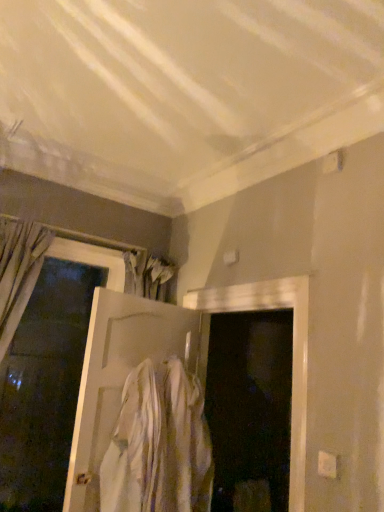
Question: Is white cotton shirt at center positioned before white matte door at center, positioned as the second door in left-to-right order?

Choices:
 (A) no
 (B) yes

Answer: (B)

Question: Considering the relative sizes of white cotton shirt at center and white matte door at center, the first door when ordered from right to left, in the image provided, is white cotton shirt at center thinner than white matte door at center, the first door when ordered from right to left,?

Choices:
 (A) yes
 (B) no

Answer: (B)

Question: Is white cotton shirt at center at the right side of white matte door at center, positioned as the second door in left-to-right order?

Choices:
 (A) no
 (B) yes

Answer: (B)

Question: Would you say white cotton shirt at center is a long distance from white matte door at center, the first door when ordered from right to left?

Choices:
 (A) yes
 (B) no

Answer: (B)

Question: Is white cotton shirt at center bigger than white matte door at center, the first door when ordered from right to left?

Choices:
 (A) no
 (B) yes

Answer: (A)

Question: Is white matte door at center, the first door when ordered from right to left, wider or thinner than white cotton shirt at center?

Choices:
 (A) thin
 (B) wide

Answer: (A)

Question: Is white matte door at center, positioned as the second door in left-to-right order, in front of or behind white cotton shirt at center in the image?

Choices:
 (A) front
 (B) behind

Answer: (B)

Question: From the image's perspective, is white matte door at center, the first door when ordered from right to left, positioned above or below white cotton shirt at center?

Choices:
 (A) above
 (B) below

Answer: (A)

Question: From a real-world perspective, relative to white cotton shirt at center, is white matte door at center, the first door when ordered from right to left, vertically above or below?

Choices:
 (A) above
 (B) below

Answer: (A)

Question: From the image's perspective, relative to white matte door at center, positioned as the second door in left-to-right order, is white matte door at left, arranged as the second door when viewed from the right, above or below?

Choices:
 (A) below
 (B) above

Answer: (B)

Question: From a real-world perspective, is white matte door at left, which ranks as the first door in left-to-right order, positioned above or below white matte door at center, positioned as the second door in left-to-right order?

Choices:
 (A) above
 (B) below

Answer: (A)

Question: Considering the positions of white matte door at left, which ranks as the first door in left-to-right order, and white matte door at center, positioned as the second door in left-to-right order, in the image, is white matte door at left, which ranks as the first door in left-to-right order, taller or shorter than white matte door at center, positioned as the second door in left-to-right order,?

Choices:
 (A) short
 (B) tall

Answer: (B)

Question: Is white matte door at left, arranged as the second door when viewed from the right, to the left or to the right of white matte door at center, the first door when ordered from right to left, in the image?

Choices:
 (A) left
 (B) right

Answer: (A)

Question: Relative to white matte door at center, positioned as the second door in left-to-right order, is white cotton shirt at center in front or behind?

Choices:
 (A) behind
 (B) front

Answer: (B)

Question: In the image, is white cotton shirt at center on the left side or the right side of white matte door at center, the first door when ordered from right to left?

Choices:
 (A) right
 (B) left

Answer: (A)